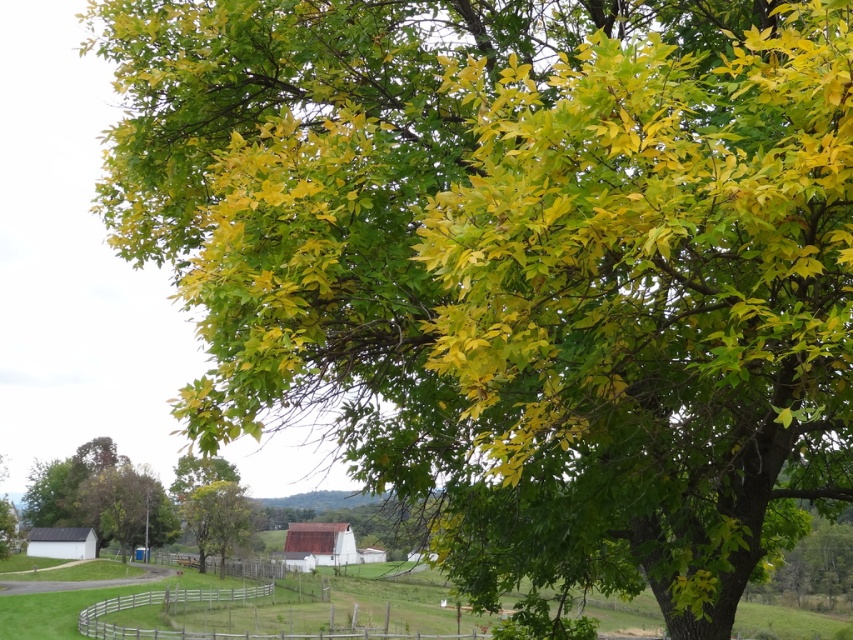
Question: Which of these objects is positioned closest to the wooden at lower center?

Choices:
 (A) brown wooden fence at lower center
 (B) green leafy tree at center

Answer: (B)

Question: Observing the image, what is the correct spatial positioning of brown wooden fence at lower center in reference to wooden at lower center?

Choices:
 (A) right
 (B) left

Answer: (A)

Question: Which is nearer to the wooden at lower center?

Choices:
 (A) brown wooden fence at lower center
 (B) green leafy tree at center

Answer: (B)

Question: Is brown wooden fence at lower center positioned at the back of wooden at lower center?

Choices:
 (A) no
 (B) yes

Answer: (A)

Question: Considering the real-world distances, which object is farthest from the wooden at lower center?

Choices:
 (A) brown wooden fence at lower center
 (B) green leafy tree at center

Answer: (A)

Question: Can you confirm if green leafy tree at center is positioned to the right of brown wooden fence at lower center?

Choices:
 (A) no
 (B) yes

Answer: (A)